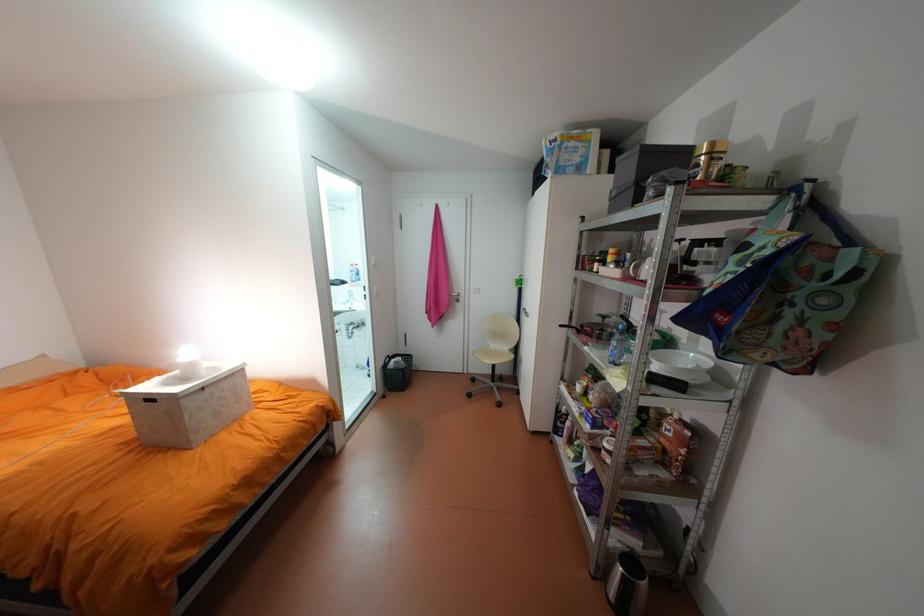
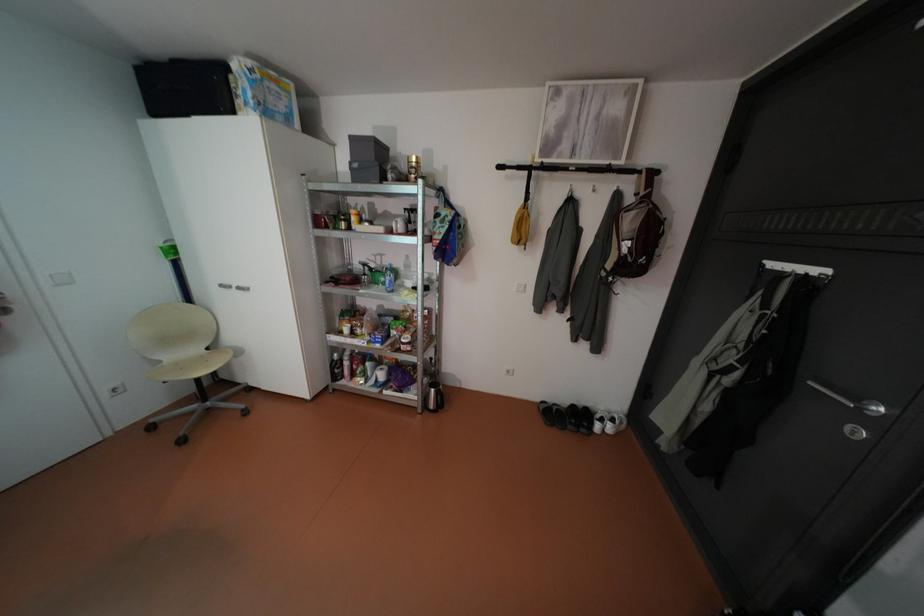
Locate, in the second image, the point that corresponds to (623,192) in the first image.

(365, 164)